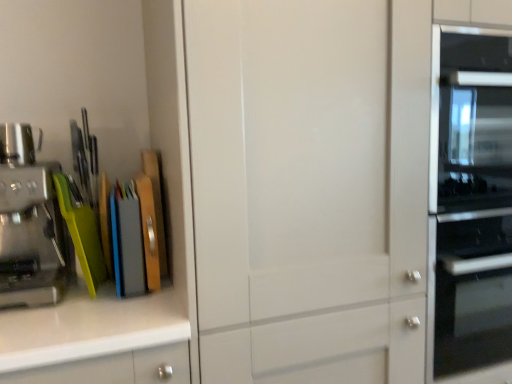
Question: Can you confirm if brushed metal coffee machine at left is taller than transparent glass cabinet at center?

Choices:
 (A) no
 (B) yes

Answer: (A)

Question: Does brushed metal coffee machine at left appear on the left side of transparent glass cabinet at center?

Choices:
 (A) no
 (B) yes

Answer: (B)

Question: Is brushed metal coffee machine at left smaller than transparent glass cabinet at center?

Choices:
 (A) no
 (B) yes

Answer: (B)

Question: Is transparent glass cabinet at center inside brushed metal coffee machine at left?

Choices:
 (A) no
 (B) yes

Answer: (A)

Question: Does brushed metal coffee machine at left appear on the right side of transparent glass cabinet at center?

Choices:
 (A) yes
 (B) no

Answer: (B)

Question: From a real-world perspective, is brushed metal coffee machine at left over transparent glass cabinet at center?

Choices:
 (A) yes
 (B) no

Answer: (A)

Question: From the image's perspective, is brushed metal coffee maker at left beneath transparent glass cabinet at center?

Choices:
 (A) yes
 (B) no

Answer: (B)

Question: From a real-world perspective, is brushed metal coffee maker at left beneath transparent glass cabinet at center?

Choices:
 (A) yes
 (B) no

Answer: (B)

Question: Is the position of brushed metal coffee maker at left more distant than that of transparent glass cabinet at center?

Choices:
 (A) yes
 (B) no

Answer: (A)

Question: Does brushed metal coffee maker at left have a lesser width compared to transparent glass cabinet at center?

Choices:
 (A) yes
 (B) no

Answer: (A)

Question: Is brushed metal coffee maker at left positioned with its back to transparent glass cabinet at center?

Choices:
 (A) yes
 (B) no

Answer: (B)

Question: Can you confirm if brushed metal coffee maker at left is smaller than transparent glass cabinet at center?

Choices:
 (A) no
 (B) yes

Answer: (B)

Question: Considering the relative sizes of brushed metal coffee machine at left and brushed metal coffee maker at left in the image provided, is brushed metal coffee machine at left wider than brushed metal coffee maker at left?

Choices:
 (A) yes
 (B) no

Answer: (A)